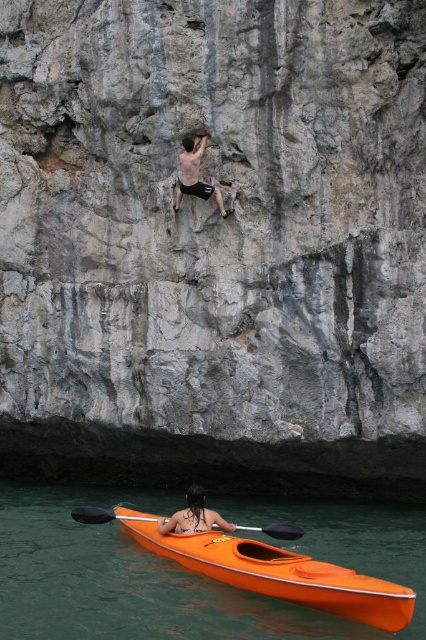
Can you confirm if dark brown hair at lower center is shorter than orange plastic paddle at lower center?

No, dark brown hair at lower center is not shorter than orange plastic paddle at lower center.

Where is `dark brown hair at lower center`? Image resolution: width=426 pixels, height=640 pixels. dark brown hair at lower center is located at coordinates (193, 516).

At what (x,y) coordinates should I click in order to perform the action: click on dark brown hair at lower center. Please return your answer as a coordinate pair (x, y). The width and height of the screenshot is (426, 640). Looking at the image, I should click on (193, 516).

Can you confirm if orange plastic kayak at lower center is positioned below smooth skin rock climber at upper center?

Yes.

In order to click on orange plastic kayak at lower center in this screenshot , I will do `click(123, 580)`.

From the picture: Does orange plastic kayak at lower center have a smaller size compared to orange plastic paddle at lower center?

No.

Which is more to the left, orange plastic kayak at lower center or orange plastic paddle at lower center?

orange plastic kayak at lower center is more to the left.

Does point (20, 620) come closer to viewer compared to point (86, 522)?

Yes, it is in front of point (86, 522).

Image resolution: width=426 pixels, height=640 pixels. I want to click on orange plastic kayak at lower center, so click(x=123, y=580).